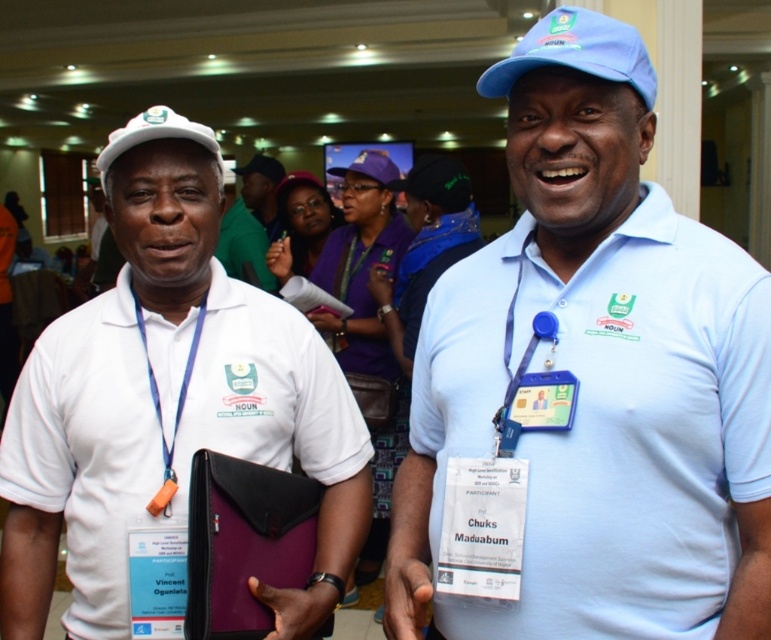
Question: Is matte green cap at center to the right of blue fabric lanyard at left from the viewer's perspective?

Choices:
 (A) no
 (B) yes

Answer: (A)

Question: Which point appears farthest from the camera in this image?

Choices:
 (A) (231, 218)
 (B) (266, 396)

Answer: (A)

Question: Is blue fabric baseball cap at upper center to the right of matte green cap at center from the viewer's perspective?

Choices:
 (A) yes
 (B) no

Answer: (A)

Question: Is white matte cap at upper left thinner than blue fabric baseball cap at upper center?

Choices:
 (A) yes
 (B) no

Answer: (B)

Question: Among these points, which one is nearest to the camera?

Choices:
 (A) (652, 76)
 (B) (160, 419)

Answer: (A)

Question: Which of the following is the closest to the observer?

Choices:
 (A) blue fabric lanyard at left
 (B) light blue polo shirt at center
 (C) matte green cap at center

Answer: (B)